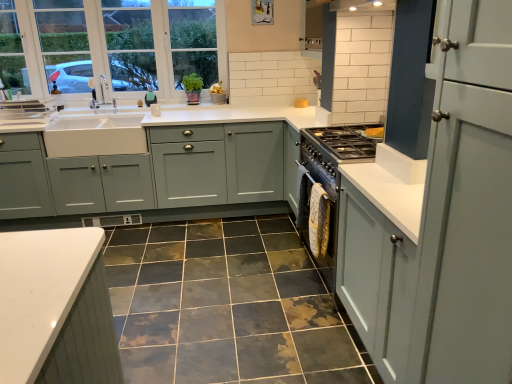
Question: Is white ceramic sink at left completely or partially outside of matte gray cabinet at right, which is counted as the second cabinetry, starting from the left?

Choices:
 (A) yes
 (B) no

Answer: (A)

Question: Considering the relative positions of white ceramic sink at left and matte gray cabinet at right, which is the 1th cabinetry from front to back, in the image provided, is white ceramic sink at left to the right of matte gray cabinet at right, which is the 1th cabinetry from front to back, from the viewer's perspective?

Choices:
 (A) no
 (B) yes

Answer: (A)

Question: Considering the relative sizes of white ceramic sink at left and matte gray cabinet at right, which is the 1th cabinetry from front to back, in the image provided, is white ceramic sink at left wider than matte gray cabinet at right, which is the 1th cabinetry from front to back,?

Choices:
 (A) yes
 (B) no

Answer: (B)

Question: Considering the relative sizes of white ceramic sink at left and matte gray cabinet at right, which is counted as the second cabinetry, starting from the left, in the image provided, is white ceramic sink at left smaller than matte gray cabinet at right, which is counted as the second cabinetry, starting from the left,?

Choices:
 (A) yes
 (B) no

Answer: (A)

Question: Does white ceramic sink at left come in front of matte gray cabinet at right, which is the 1th cabinetry from front to back?

Choices:
 (A) yes
 (B) no

Answer: (B)

Question: Does white ceramic sink at left have a lesser height compared to matte gray cabinet at right, which is counted as the 1th cabinetry, starting from the right?

Choices:
 (A) yes
 (B) no

Answer: (A)

Question: Is matte gray cabinet at right, which is counted as the second cabinetry, starting from the left, facing towards teal fabric at upper left?

Choices:
 (A) no
 (B) yes

Answer: (A)

Question: Can you confirm if matte gray cabinet at right, which is counted as the second cabinetry, starting from the left, is smaller than teal fabric at upper left?

Choices:
 (A) no
 (B) yes

Answer: (A)

Question: From a real-world perspective, is matte gray cabinet at right, which is counted as the second cabinetry, starting from the left, positioned over teal fabric at upper left based on gravity?

Choices:
 (A) no
 (B) yes

Answer: (A)

Question: Is matte gray cabinet at right, which is counted as the 1th cabinetry, starting from the right, surrounding teal fabric at upper left?

Choices:
 (A) no
 (B) yes

Answer: (A)

Question: Does matte gray cabinet at right, which is the 1th cabinetry from front to back, have a lesser height compared to teal fabric at upper left?

Choices:
 (A) no
 (B) yes

Answer: (A)

Question: Can you confirm if matte gray cabinet at right, which is counted as the 1th cabinetry, starting from the right, is positioned to the right of teal fabric at upper left?

Choices:
 (A) yes
 (B) no

Answer: (A)

Question: Are white glass window at upper left and matte gray cabinets at center, which is the second cabinetry in right-to-left order, making contact?

Choices:
 (A) yes
 (B) no

Answer: (B)